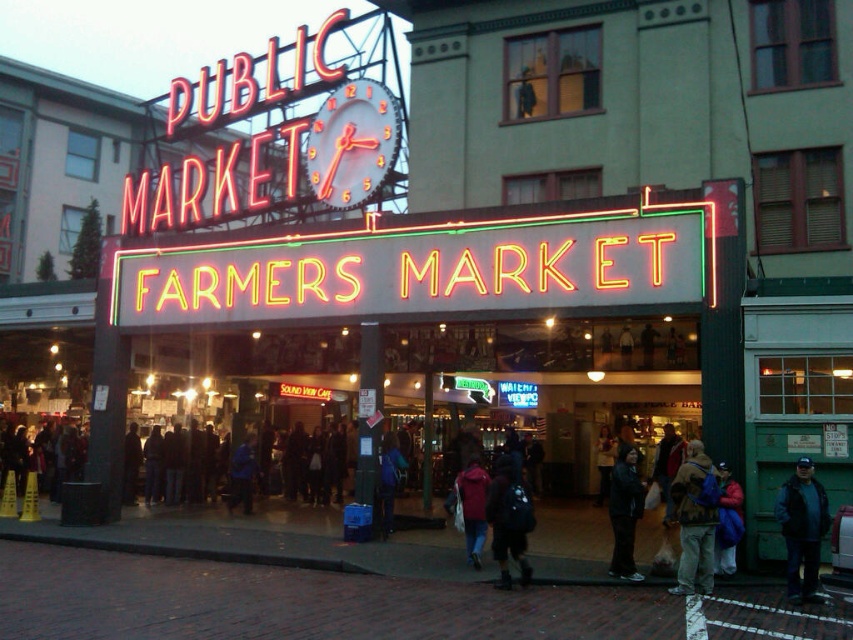
You are standing at the entrance of the Pike Place Market and want to know if you can see both the metallic clock face at upper center and the dark red jacket at center from your current position. Can you see both at the same time?

Yes, the metallic clock face at upper center and dark red jacket at center are 29.49 meters apart, so they are within a visible range from the entrance.

Consider the image. You are standing at the entrance of the Pike Place Market and want to reach the point marked at coordinates point (514, 292). Given that the distance between you and this point is 45.84 meters, can you estimate how long it would take to walk there at a normal pace of 1.4 meters per second?

The distance between you and point (514, 292) is 45.84 meters. At a normal walking pace of 1.4 meters per second, it would take approximately 32.7 seconds to reach the point.

What object is located at the coordinate point [352,141] in the image of the Pike Place Market entrance?

The metallic clock face at upper center is located at the coordinate point [352,141].